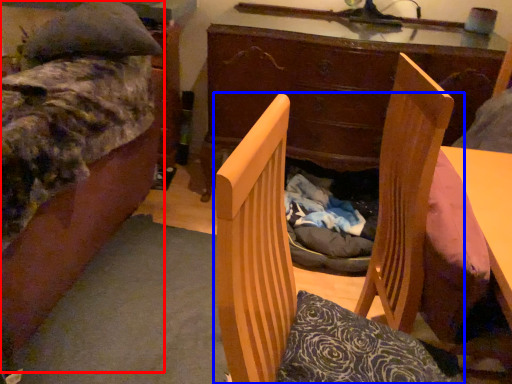
Question: Which of the following is the farthest to the observer, bed (highlighted by a red box) or chair (highlighted by a blue box)?

Choices:
 (A) bed
 (B) chair

Answer: (A)